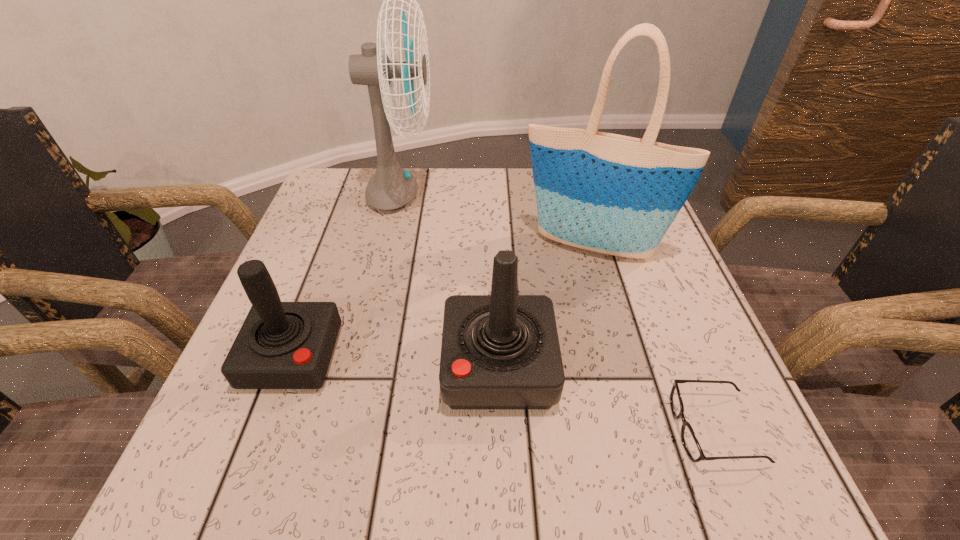
The width and height of the screenshot is (960, 540). Find the location of `vacant area located on the front-facing side of the right joystick`. vacant area located on the front-facing side of the right joystick is located at coordinates (299, 366).

I want to click on free space located 0.310m on the front-facing side of the right joystick, so click(x=256, y=366).

Locate an element on the screen. Image resolution: width=960 pixels, height=540 pixels. free region located on the base of the fourth tallest object is located at coordinates coord(265,430).

Locate an element on the screen. free space located 0.280m on the front-facing side of the shortest object is located at coordinates (483, 429).

Where is `vacant position located 0.060m on the front-facing side of the shortest object`? vacant position located 0.060m on the front-facing side of the shortest object is located at coordinates (634, 429).

At what (x,y) coordinates should I click in order to perform the action: click on free space located 0.070m on the front-facing side of the shortest object. Please return your answer as a coordinate pair (x, y). Looking at the image, I should click on (627, 429).

I want to click on object that is at the far edge, so click(391, 187).

Where is `object that is at the near edge`? object that is at the near edge is located at coordinates (689, 440).

You are a GUI agent. You are given a task and a screenshot of the screen. Output one action in this format:
    pyautogui.click(x=<x>, y=<y>)
    Task: Click on the fan present at the left edge
    
    Given the screenshot: What is the action you would take?
    pyautogui.click(x=391, y=187)

The width and height of the screenshot is (960, 540). What are the coordinates of `joystick that is positioned at the left edge` in the screenshot? It's located at (281, 345).